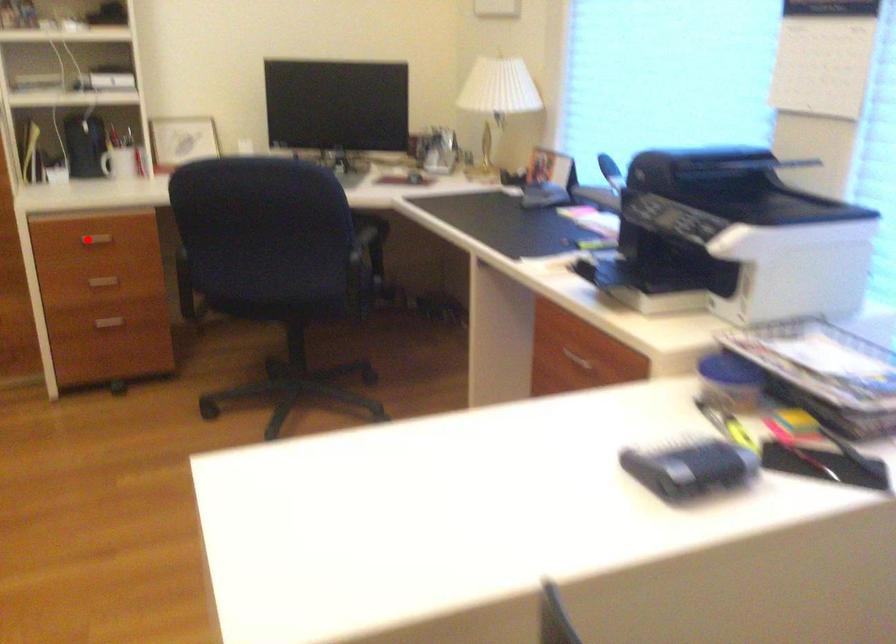
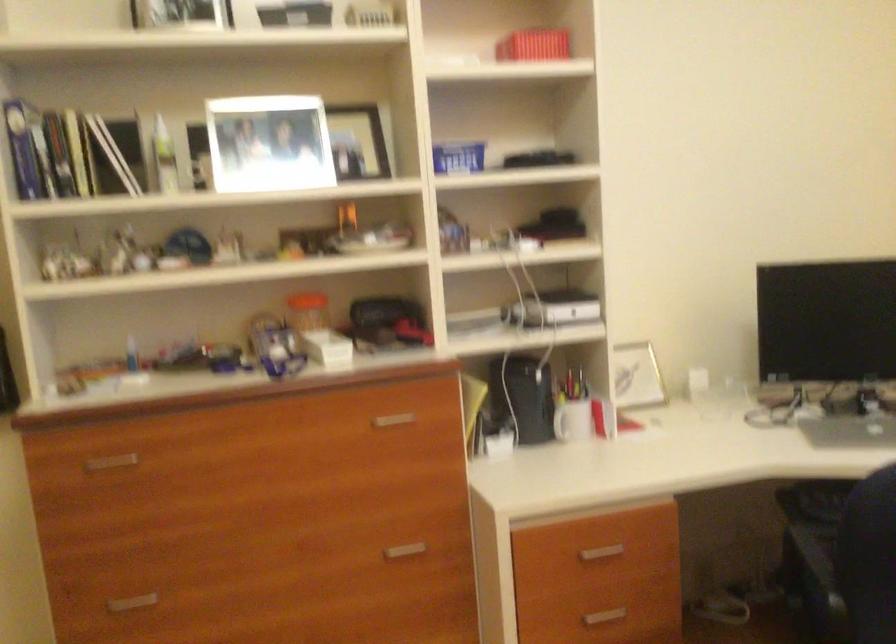
Locate, in the second image, the point that corresponds to the highlighted location in the first image.

(600, 553)